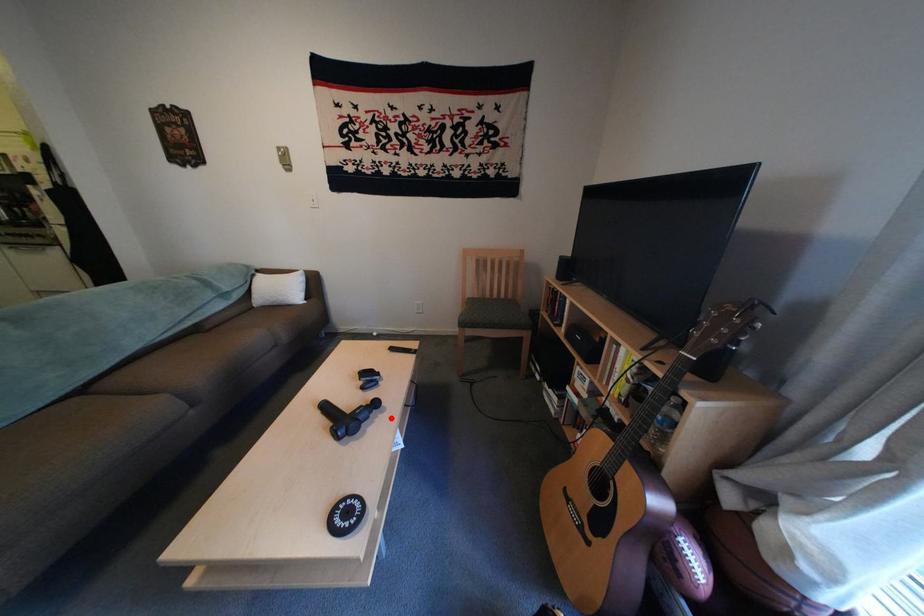
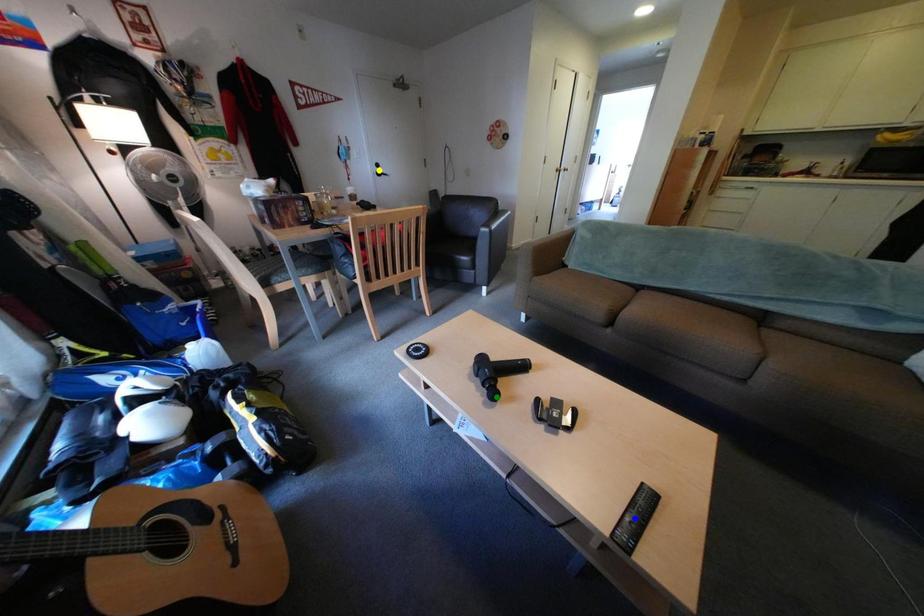
Question: I am providing you with two images of the same scene from different viewpoints. A red point is marked on the first image. You are given multiple points on the second image. Which point in image 2 is actually the same real-world point as the red point in image 1?

Choices:
 (A) yellow point
 (B) green point
 (C) blue point

Answer: (B)